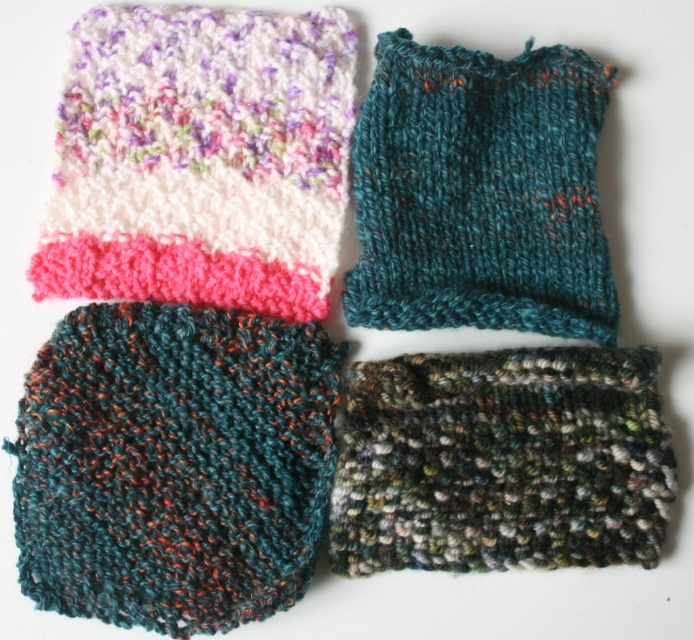
How far apart are multicolored yarn sock at bottom right and teal knitted sock at upper right?

They are 9.65 inches apart.

Who is more forward, (440,451) or (414,257)?

Positioned in front is point (440,451).

Where is `multicolored yarn sock at bottom right`? multicolored yarn sock at bottom right is located at coordinates (500, 461).

Is multicolored knitted sock at upper left thinner than multicolored yarn sock at bottom right?

Correct, multicolored knitted sock at upper left's width is less than multicolored yarn sock at bottom right's.

Is multicolored knitted sock at upper left to the left of multicolored yarn sock at bottom right from the viewer's perspective?

Correct, you'll find multicolored knitted sock at upper left to the left of multicolored yarn sock at bottom right.

Between point (117, 136) and point (663, 433), which one is positioned in front?

Point (663, 433) is more forward.

Find the location of a particular element. Image resolution: width=694 pixels, height=640 pixels. multicolored knitted sock at upper left is located at coordinates (201, 157).

Does multicolored knitted sock at bottom left have a lesser width compared to multicolored knitted sock at upper left?

Yes.

Which is in front, point (139, 330) or point (78, 282)?

Positioned in front is point (139, 330).

Locate an element on the screen. The image size is (694, 640). multicolored knitted sock at bottom left is located at coordinates (174, 465).

I want to click on multicolored knitted sock at bottom left, so click(x=174, y=465).